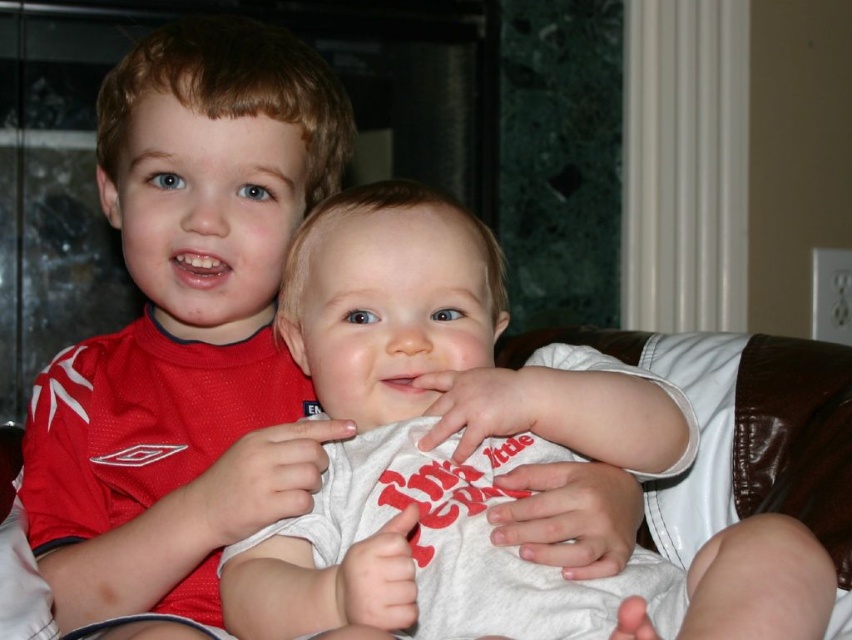
Question: Which of the following is the farthest from the observer?

Choices:
 (A) (268, 160)
 (B) (628, 579)

Answer: (A)

Question: Does white cotton shirt at center have a lesser width compared to matte red shirt at upper left?

Choices:
 (A) yes
 (B) no

Answer: (B)

Question: Can you confirm if white cotton shirt at center is smaller than matte red shirt at upper left?

Choices:
 (A) yes
 (B) no

Answer: (A)

Question: Which point is closer to the camera?

Choices:
 (A) (312, 260)
 (B) (107, 193)

Answer: (A)

Question: Does white cotton shirt at center come behind matte red shirt at upper left?

Choices:
 (A) no
 (B) yes

Answer: (A)